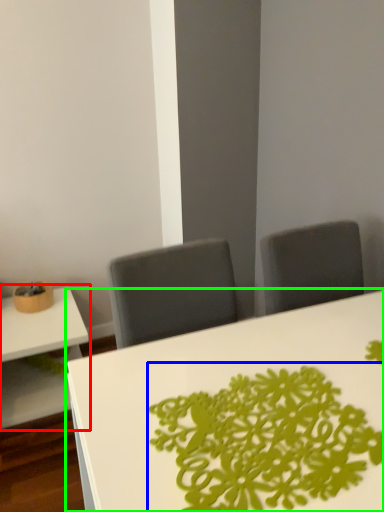
Question: Which is nearer to the table (highlighted by a red box)? floral arrangement (highlighted by a blue box) or table (highlighted by a green box).

Choices:
 (A) floral arrangement
 (B) table

Answer: (B)